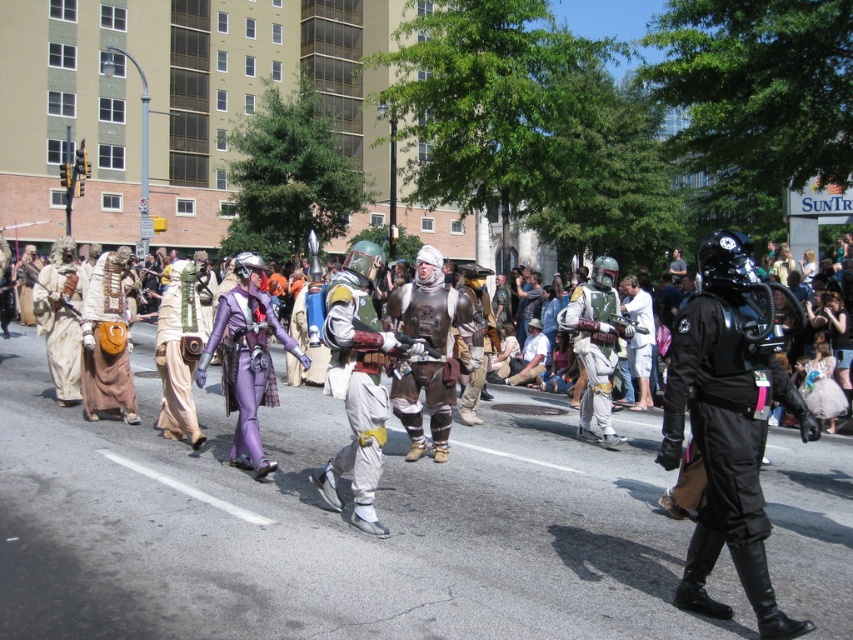
Between point (312, 368) and point (257, 470), which one is positioned behind?

The point (312, 368) is behind.

The width and height of the screenshot is (853, 640). What do you see at coordinates (329, 525) in the screenshot?
I see `purple metallic costume at center` at bounding box center [329, 525].

The height and width of the screenshot is (640, 853). Identify the location of purple metallic costume at center. (329, 525).

Is purple metallic costume at center behind tan fabric bag at left?

No, it is not.

The width and height of the screenshot is (853, 640). What do you see at coordinates (329, 525) in the screenshot? I see `purple metallic costume at center` at bounding box center [329, 525].

The width and height of the screenshot is (853, 640). I want to click on purple metallic costume at center, so click(x=329, y=525).

Identify the location of purple metallic costume at center. This screenshot has height=640, width=853. coord(329,525).

Who is taller, purple metallic costume at center or metallic silver armor at center?

With more height is purple metallic costume at center.

Does point (70, 516) come in front of point (585, 316)?

Yes, point (70, 516) is in front of point (585, 316).

You are a GUI agent. You are given a task and a screenshot of the screen. Output one action in this format:
    pyautogui.click(x=<x>, y=<y>)
    Task: Click on the purple metallic costume at center
    This screenshot has height=640, width=853.
    Given the screenshot: What is the action you would take?
    pyautogui.click(x=329, y=525)